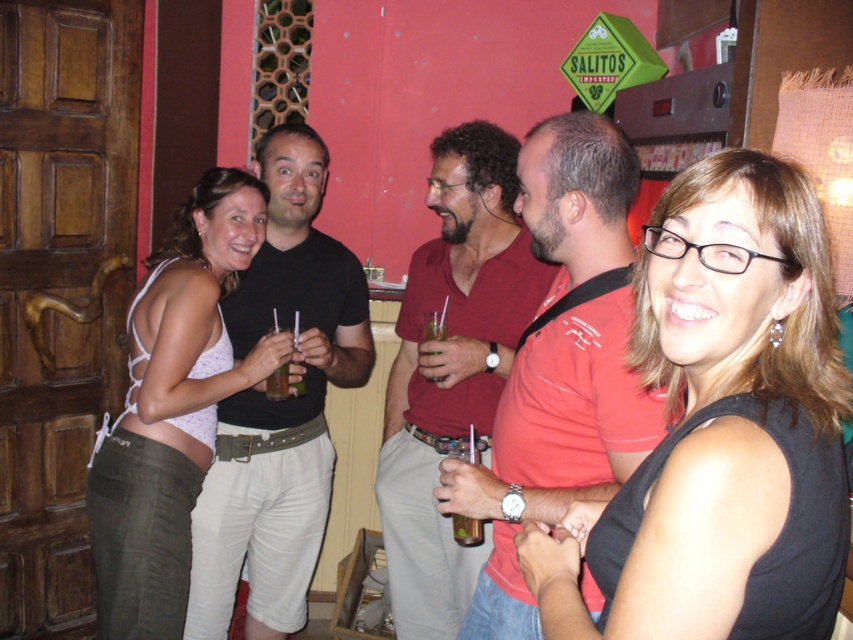
You are a bartender trying to serve a customer. You see the matte white tank top at center and the translucent plastic cup at center. Which object is closer to you?

The distance between the matte white tank top at center and the translucent plastic cup at center is 24.21 inches, but since both are at the same central position, their proximity to you depends on their depth placement. However, without depth information, we can only state their lateral separation.

You are a photographer positioned at the entrance of the bar. You want to capture a candid shot of both the black cotton shirt at center and the matte white tank top at center without moving your camera. Can you fit both subjects into your current frame given their distance apart?

The black cotton shirt at center is 9.08 inches from the matte white tank top at center. Since the distance between them is less than the camera frame width, both can be captured in the same shot without moving the camera.

Looking at this image, you are a photographer at the bar and want to take a group photo of the black cotton shirt at center and the matte white tank top at center. To ensure both are in focus, you need to know which one is taller. Can you tell me which is taller?

The black cotton shirt at center has a greater height compared to the matte white tank top at center, so the black cotton shirt at center is taller.